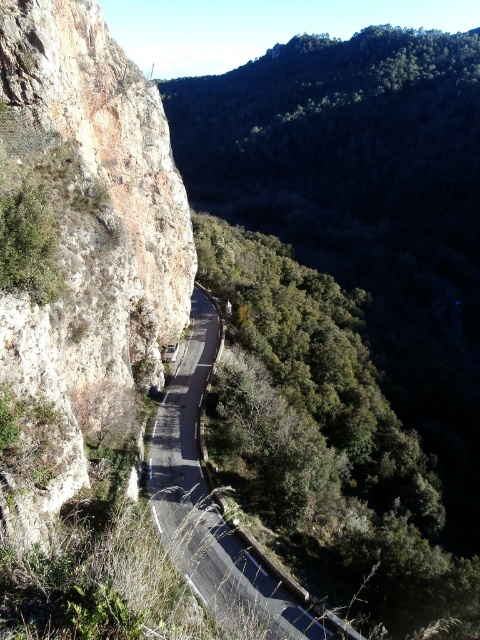
Question: Does rusty rock cliff at left have a smaller size compared to asphalt road at center?

Choices:
 (A) yes
 (B) no

Answer: (B)

Question: Is rusty rock cliff at left smaller than asphalt road at center?

Choices:
 (A) yes
 (B) no

Answer: (B)

Question: Which point is farther to the camera?

Choices:
 (A) rusty rock cliff at left
 (B) asphalt road at center

Answer: (B)

Question: Which point is farther from the camera taking this photo?

Choices:
 (A) (31, 172)
 (B) (191, 564)

Answer: (A)

Question: Can you confirm if rusty rock cliff at left is positioned to the right of asphalt road at center?

Choices:
 (A) yes
 (B) no

Answer: (B)

Question: Among these points, which one is nearest to the camera?

Choices:
 (A) (199, 492)
 (B) (45, 42)

Answer: (B)